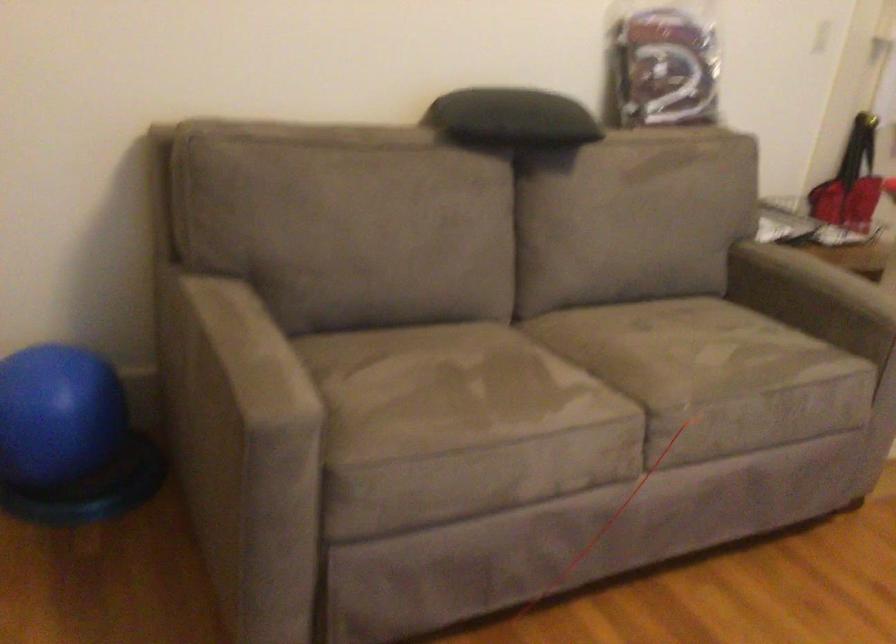
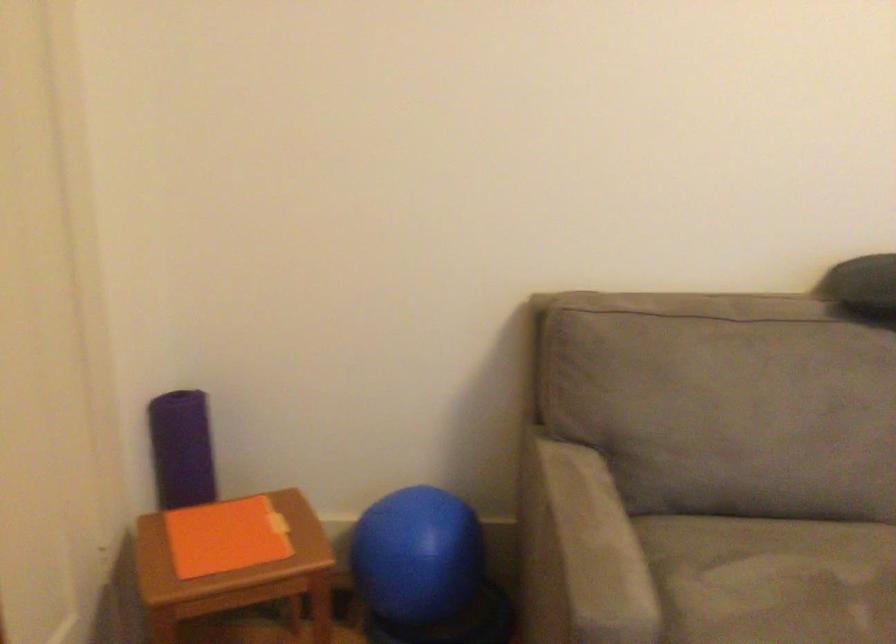
Where in the second image is the point corresponding to pixel 251 362 from the first image?

(588, 550)